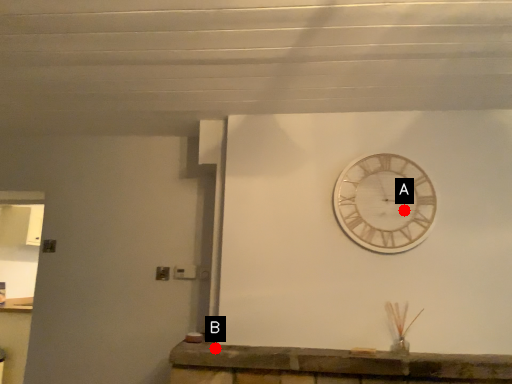
Question: Two points are circled on the image, labeled by A and B beside each circle. Among these points, which one is farthest from the camera?

Choices:
 (A) A is further
 (B) B is further

Answer: (A)